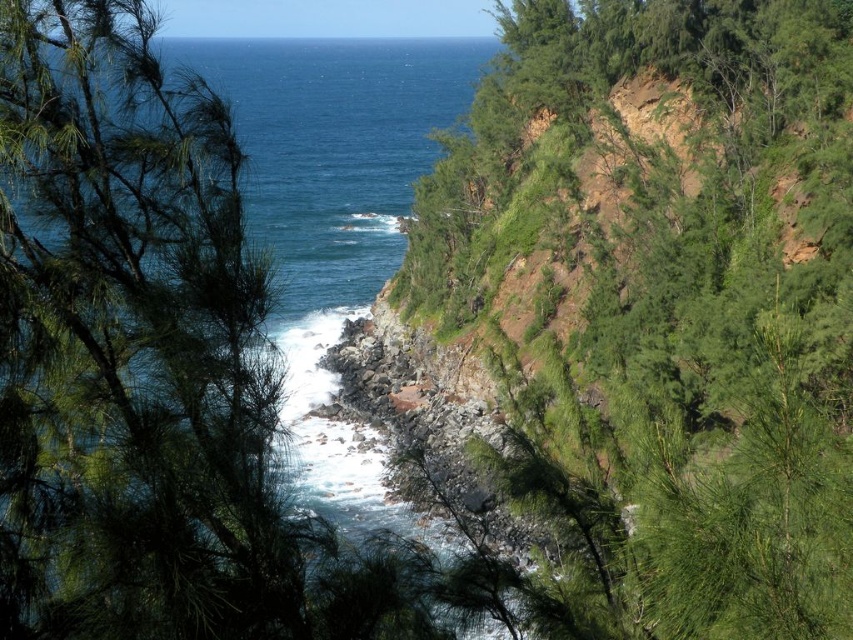
You are standing at the edge of the cliff overlooking the coastal scene. You notice the green leafy tree at upper right and the blue water at center. Which object appears smaller in size from your viewpoint?

The green leafy tree at upper right appears smaller in size compared to the blue water at center from your viewpoint.

You are standing at the point with coordinates point (795, 83) and want to walk towards the point with coordinates point (291, 195). Based on the scene description, will you have to go through the rugged coastline area?

Yes, since point (795, 83) is in front of point (291, 195), you will have to go through the rugged coastline area to reach your destination.

You are standing at the point marked as point [670,308] in the coastal scene. What can you see in the immediate vicinity?

At point [670,308], there is a green leafy tree at upper right nearby.